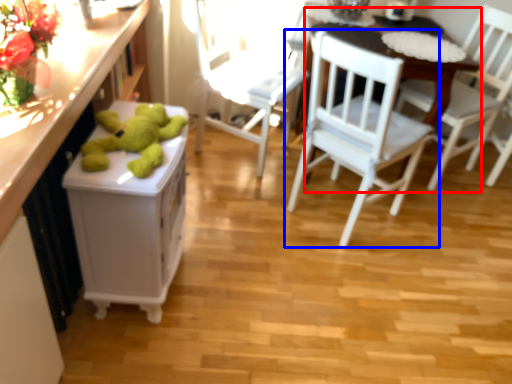
Question: Which object is closer to the camera taking this photo, table (highlighted by a red box) or chair (highlighted by a blue box)?

Choices:
 (A) table
 (B) chair

Answer: (B)